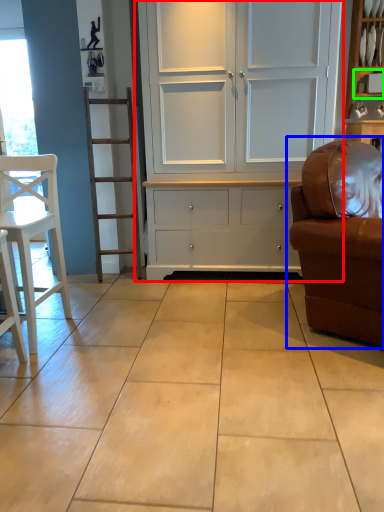
Question: Considering the real-world distances, which object is farthest from cupboard (highlighted by a red box)? studio couch (highlighted by a blue box) or shelf (highlighted by a green box)?

Choices:
 (A) studio couch
 (B) shelf

Answer: (B)